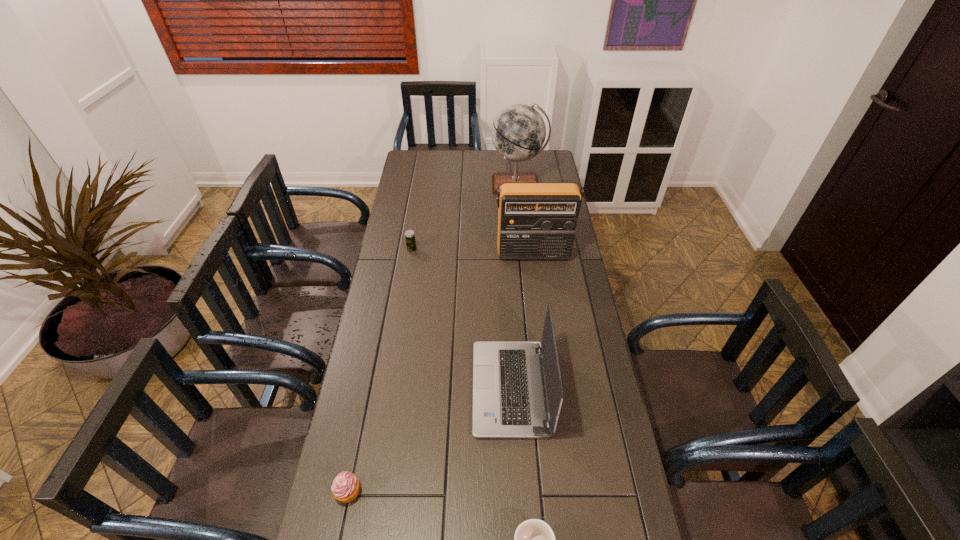
You are a GUI agent. You are given a task and a screenshot of the screen. Output one action in this format:
    pyautogui.click(x=<x>, y=<y>)
    Task: Click on the vacant area that lies between the beer can and the farthest object
    The height and width of the screenshot is (540, 960).
    Given the screenshot: What is the action you would take?
    pyautogui.click(x=465, y=217)

Identify which object is the fourth closest to the tallest object. Please provide its 2D coordinates. Your answer should be formatted as a tuple, i.e. [(x, y)], where the tuple contains the x and y coordinates of a point satisfying the conditions above.

[(345, 488)]

In order to click on object that is the fifth closest to the second tallest object in this screenshot , I will do `click(534, 539)`.